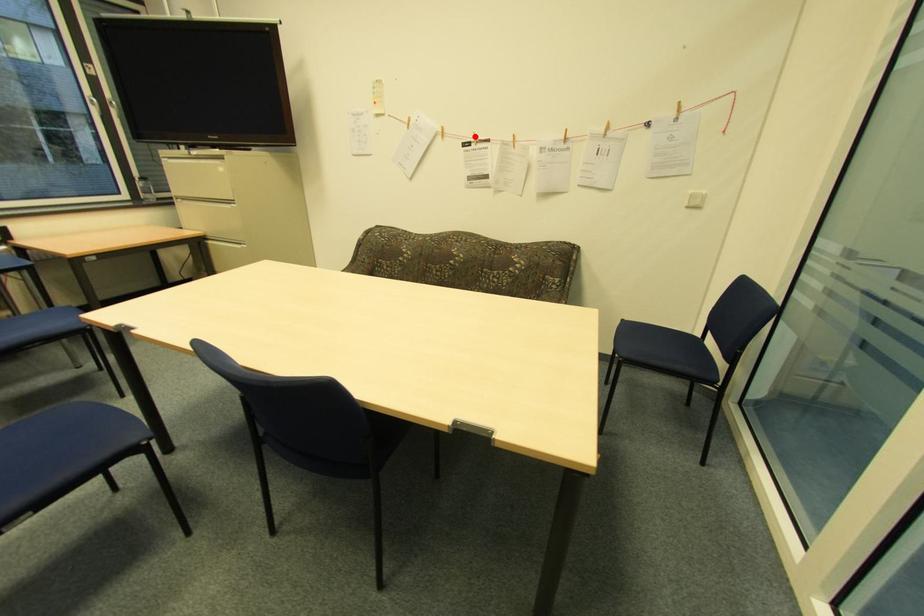
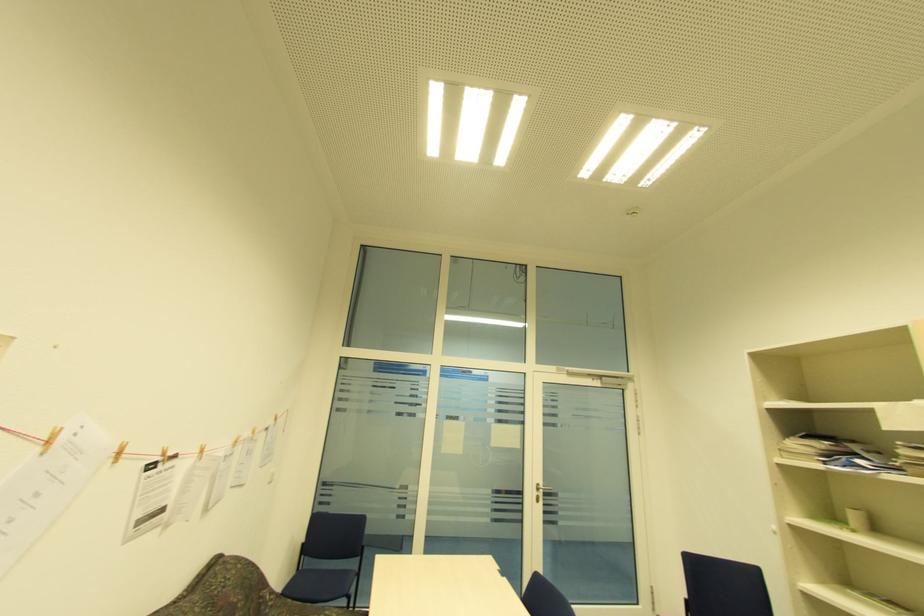
Question: I am providing you with two images of the same scene from different viewpoints. Given a red point in image1, look at the same physical point in image2. Is it:

Choices:
 (A) Closer to the viewpoint
 (B) Farther from the viewpoint

Answer: (B)